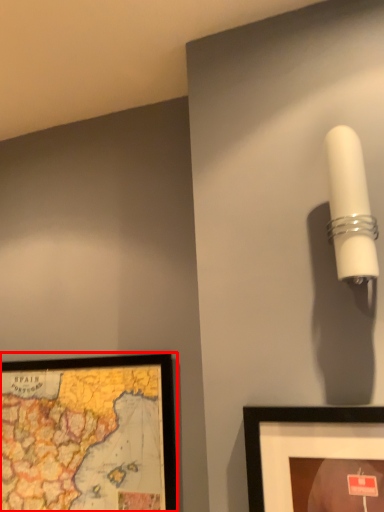
Question: Considering the relative positions of picture frame (annotated by the red box) and lamp in the image provided, where is picture frame (annotated by the red box) located with respect to the staircase?

Choices:
 (A) left
 (B) right

Answer: (A)